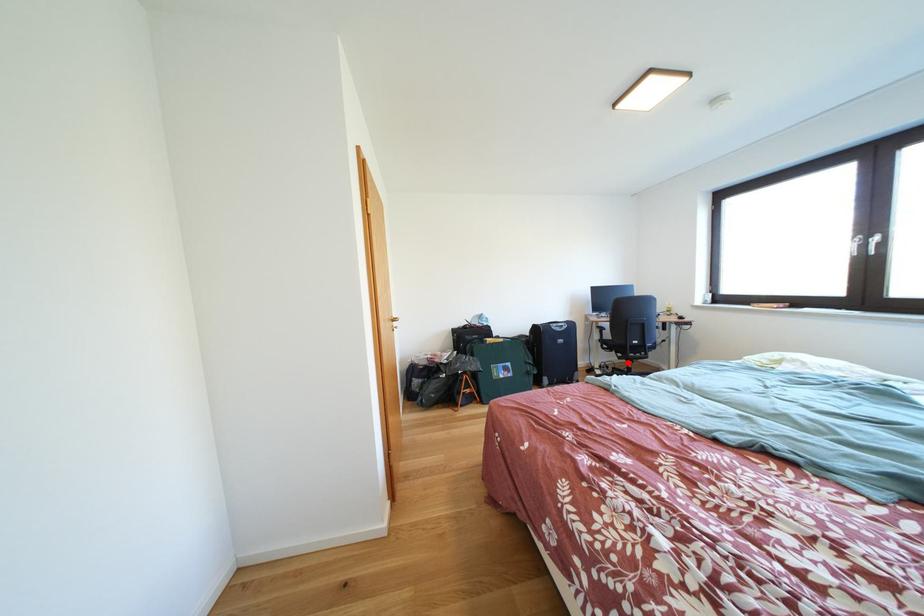
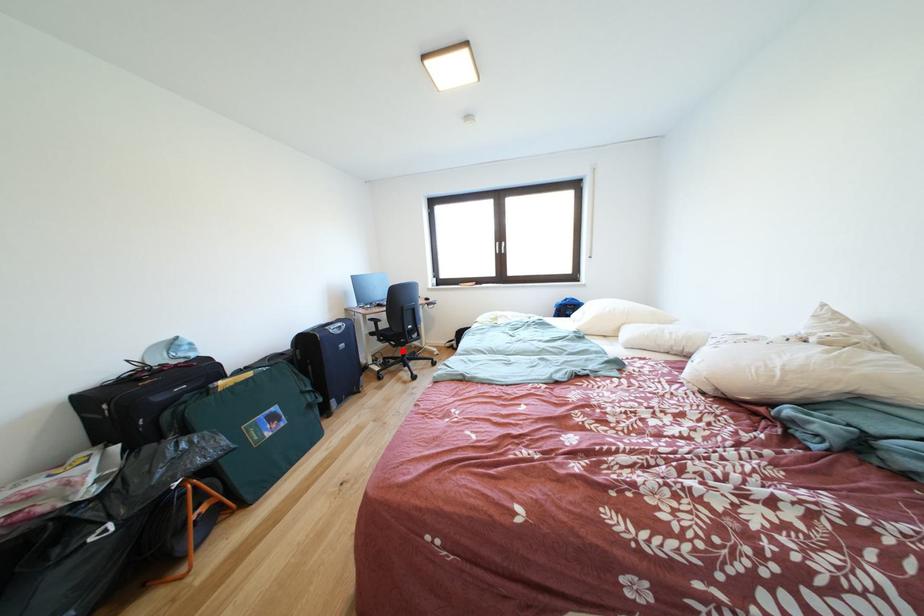
I am providing you with two images of the same scene from different viewpoints. A red point is marked on the first image and another point is marked on the second image. Does the point marked in image1 correspond to the same location as the one in image2?

Yes